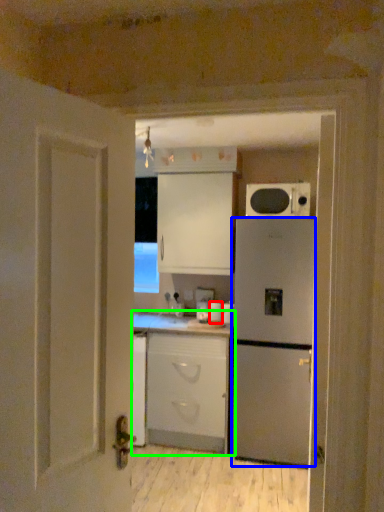
Question: Which object is positioned farthest from appliance (highlighted by a red box)? Select from refrigerator (highlighted by a blue box) and cabinetry (highlighted by a green box).

Choices:
 (A) refrigerator
 (B) cabinetry

Answer: (A)